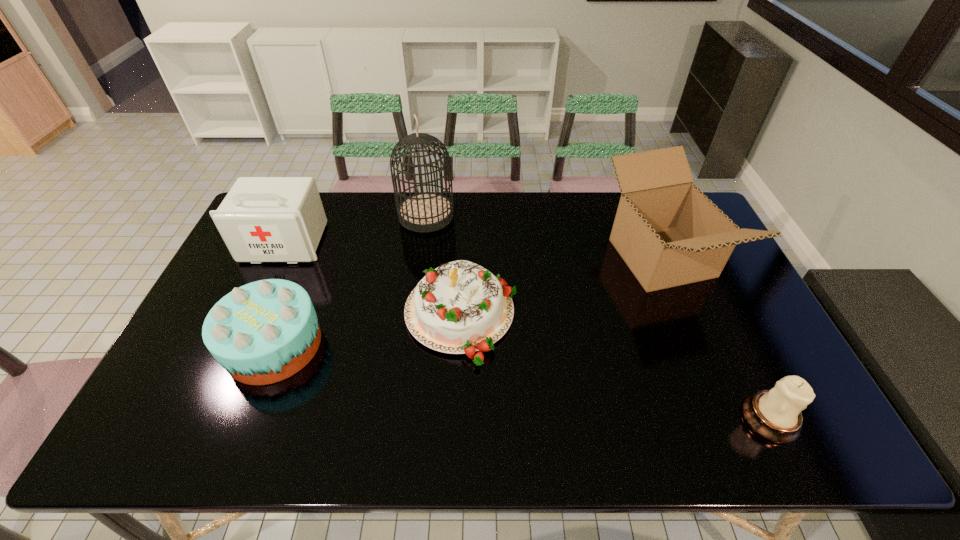
Where is `vacant region between the box and the candle holder`? vacant region between the box and the candle holder is located at coordinates (715, 338).

The height and width of the screenshot is (540, 960). Identify the location of object identified as the third closest to the first-aid kit. (460, 307).

At what (x,y) coordinates should I click in order to perform the action: click on object that can be found as the closest to the first-aid kit. Please return your answer as a coordinate pair (x, y). This screenshot has width=960, height=540. Looking at the image, I should click on (263, 332).

Find the location of a particular element. vacant area that satisfies the following two spatial constraints: 1. on the front-facing side of the first-aid kit; 2. on the right side of the box is located at coordinates (277, 258).